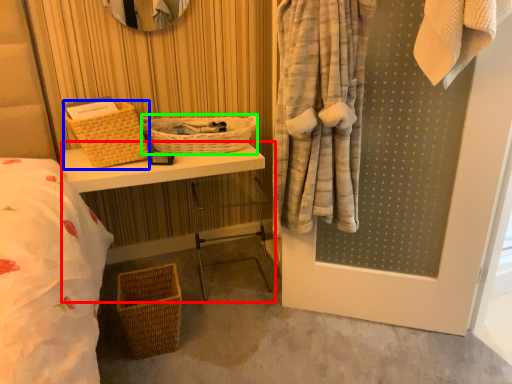
Question: Based on their relative distances, which object is nearer to table (highlighted by a red box)? Choose from basket (highlighted by a blue box) and basket (highlighted by a green box).

Choices:
 (A) basket
 (B) basket

Answer: (A)